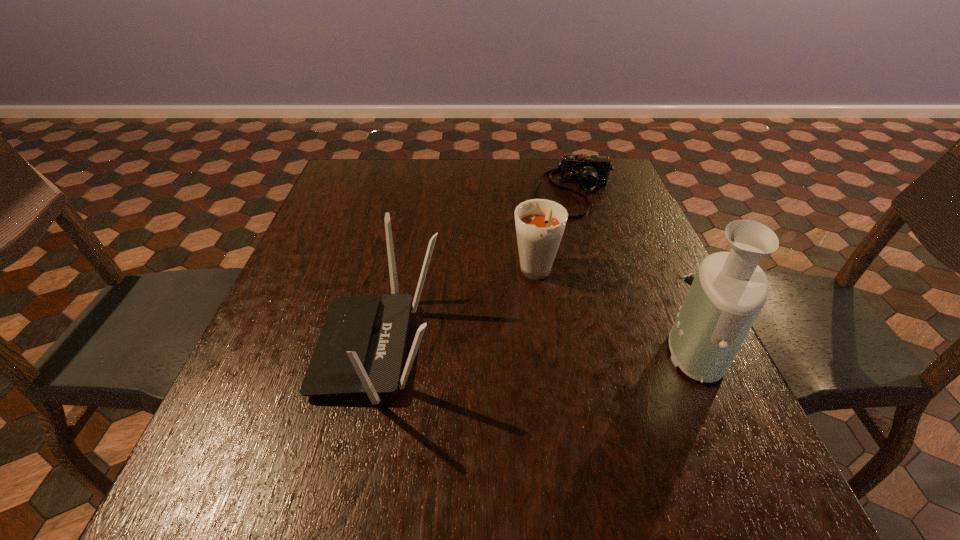
I want to click on router, so click(360, 348).

The width and height of the screenshot is (960, 540). I want to click on the tallest object, so click(729, 290).

You are a GUI agent. You are given a task and a screenshot of the screen. Output one action in this format:
    pyautogui.click(x=<x>, y=<y>)
    Task: Click on the shortest object
    The image size is (960, 540).
    Given the screenshot: What is the action you would take?
    pyautogui.click(x=588, y=171)

Image resolution: width=960 pixels, height=540 pixels. In order to click on camera in this screenshot , I will do `click(588, 171)`.

You are a GUI agent. You are given a task and a screenshot of the screen. Output one action in this format:
    pyautogui.click(x=<x>, y=<y>)
    Task: Click on the root beer
    
    Given the screenshot: What is the action you would take?
    pyautogui.click(x=540, y=223)

Identify the location of free region located on the front-facing side of the router. Image resolution: width=960 pixels, height=540 pixels. (274, 349).

Image resolution: width=960 pixels, height=540 pixels. What are the coordinates of `free point located on the front-facing side of the router` in the screenshot? It's located at [x=274, y=349].

Image resolution: width=960 pixels, height=540 pixels. Identify the location of free location located on the front-facing side of the router. (258, 349).

This screenshot has height=540, width=960. What are the coordinates of `vacant area situated on the back of the tallest object` in the screenshot? It's located at (672, 288).

Where is `blank space located 0.310m on the front-facing side of the camera`? This screenshot has height=540, width=960. blank space located 0.310m on the front-facing side of the camera is located at coordinates (574, 298).